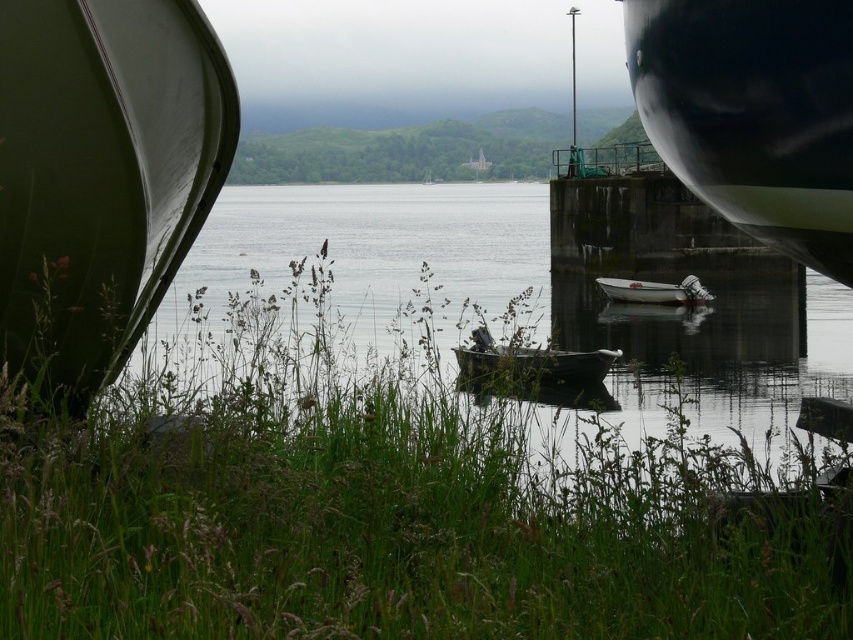
You are an observer standing at the lakeside. You see the green matte boat at left and the wooden boat at center. Which boat is taller?

The green matte boat at left is taller than the wooden boat at center.

You are standing at the lakeside and want to walk to the green matte boat at left. Is the green grass at center blocking your path?

The green grass at center is in front of the green matte boat at left, so it is blocking your path.

You are standing at the lakeside and see the green grass at center and the green matte boat at left. Which object is located to the left of the other?

The green matte boat at left is positioned to the left of the green grass at center.